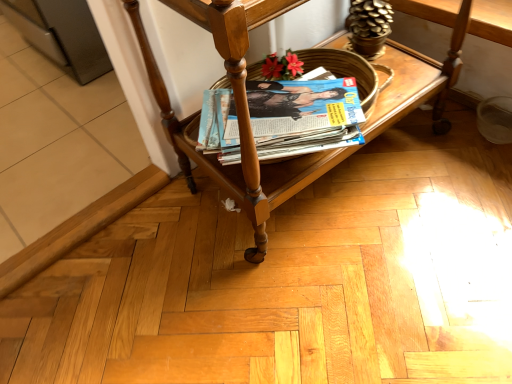
Where is `wooden magazine rack at center`? The image size is (512, 384). wooden magazine rack at center is located at coordinates (240, 114).

What do you see at coordinates (240, 114) in the screenshot?
I see `wooden magazine rack at center` at bounding box center [240, 114].

In order to face matte paper magazine at center, should I rotate leftwards or rightwards?

It's best to rotate right around 2.557 degrees.

This screenshot has width=512, height=384. What do you see at coordinates (304, 116) in the screenshot?
I see `matte paper magazine at center` at bounding box center [304, 116].

At what (x,y) coordinates should I click in order to perform the action: click on matte paper magazine at center. Please return your answer as a coordinate pair (x, y). Looking at the image, I should click on (304, 116).

Identify the location of wooden magazine rack at center. The height and width of the screenshot is (384, 512). (240, 114).

Based on the photo, can you confirm if matte paper magazine at center is positioned to the left of wooden magazine rack at center?

Yes, matte paper magazine at center is to the left of wooden magazine rack at center.

Is matte paper magazine at center positioned in front of wooden magazine rack at center?

No, matte paper magazine at center is further to the viewer.

Considering the points (282, 109) and (233, 24), which point is in front, point (282, 109) or point (233, 24)?

The point (233, 24) is in front.

From the image's perspective, is matte paper magazine at center on top of wooden magazine rack at center?

Actually, matte paper magazine at center appears below wooden magazine rack at center in the image.

From a real-world perspective, is matte paper magazine at center positioned under wooden magazine rack at center based on gravity?

Correct, in the physical world, matte paper magazine at center is lower than wooden magazine rack at center.

Between matte paper magazine at center and wooden magazine rack at center, which one has larger width?

wooden magazine rack at center.

Considering the relative sizes of matte paper magazine at center and wooden magazine rack at center in the image provided, is matte paper magazine at center taller than wooden magazine rack at center?

No.

Considering the relative sizes of matte paper magazine at center and wooden magazine rack at center in the image provided, is matte paper magazine at center bigger than wooden magazine rack at center?

Actually, matte paper magazine at center might be smaller than wooden magazine rack at center.

Is matte paper magazine at center outside of wooden magazine rack at center?

Actually, matte paper magazine at center is at least partially inside wooden magazine rack at center.

Can you see matte paper magazine at center touching wooden magazine rack at center?

No.

Is matte paper magazine at center positioned with its back to wooden magazine rack at center?

Correct, matte paper magazine at center is looking away from wooden magazine rack at center.

How many degrees apart are the facing directions of matte paper magazine at center and wooden magazine rack at center?

matte paper magazine at center and wooden magazine rack at center are facing 35.5 degrees away from each other.

Locate an element on the screen. The height and width of the screenshot is (384, 512). furniture lying on the right of matte paper magazine at center is located at coordinates (240, 114).

Is wooden magazine rack at center to the left of matte paper magazine at center from the viewer's perspective?

No, wooden magazine rack at center is not to the left of matte paper magazine at center.

Which object is closer to the camera taking this photo, wooden magazine rack at center or matte paper magazine at center?

wooden magazine rack at center.

Which is closer, (181, 145) or (334, 129)?

Point (181, 145) appears to be farther away from the viewer than point (334, 129).

From the image's perspective, which object appears higher, wooden magazine rack at center or matte paper magazine at center?

wooden magazine rack at center, from the image's perspective.

From a real-world perspective, between wooden magazine rack at center and matte paper magazine at center, who is vertically higher?

wooden magazine rack at center.

Between wooden magazine rack at center and matte paper magazine at center, which one has larger width?

wooden magazine rack at center.

From the picture: Which of these two, wooden magazine rack at center or matte paper magazine at center, stands taller?

With more height is wooden magazine rack at center.

Consider the image. Can you confirm if wooden magazine rack at center is bigger than matte paper magazine at center?

Yes, wooden magazine rack at center is bigger than matte paper magazine at center.

Would you say wooden magazine rack at center is outside matte paper magazine at center?

That's correct, wooden magazine rack at center is outside of matte paper magazine at center.

Would you say wooden magazine rack at center is a long distance from matte paper magazine at center?

wooden magazine rack at center is actually quite close to matte paper magazine at center.

Does wooden magazine rack at center turn towards matte paper magazine at center?

Yes, wooden magazine rack at center is aimed at matte paper magazine at center.

Based on the photo, what's the angular difference between wooden magazine rack at center and matte paper magazine at center's facing directions?

They differ by 35.5 degrees in their facing directions.

The height and width of the screenshot is (384, 512). I want to click on furniture above the matte paper magazine at center (from the image's perspective), so click(x=240, y=114).

This screenshot has height=384, width=512. I want to click on furniture in front of the matte paper magazine at center, so click(x=240, y=114).

Identify the location of furniture that appears above the matte paper magazine at center (from the image's perspective). This screenshot has width=512, height=384. (240, 114).